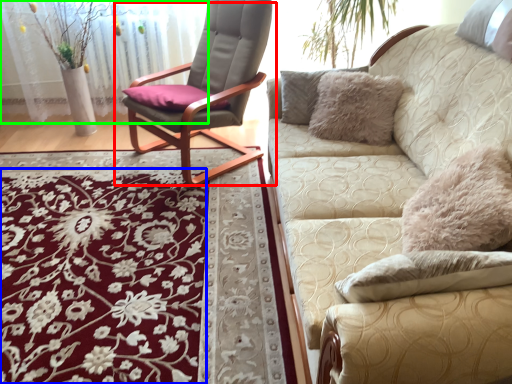
Question: Which is nearer to the chair (highlighted by a red box)? flower (highlighted by a blue box) or glass door (highlighted by a green box).

Choices:
 (A) flower
 (B) glass door

Answer: (B)